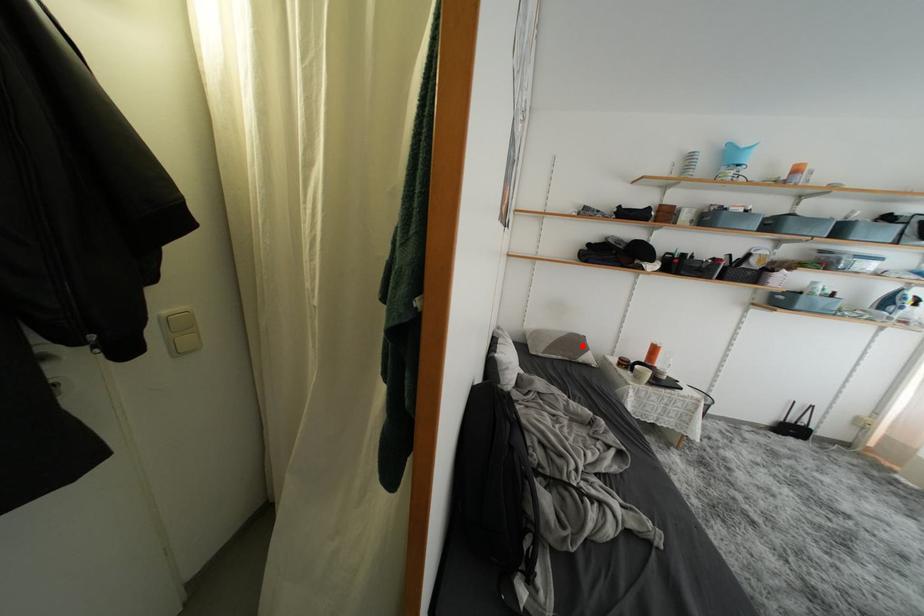
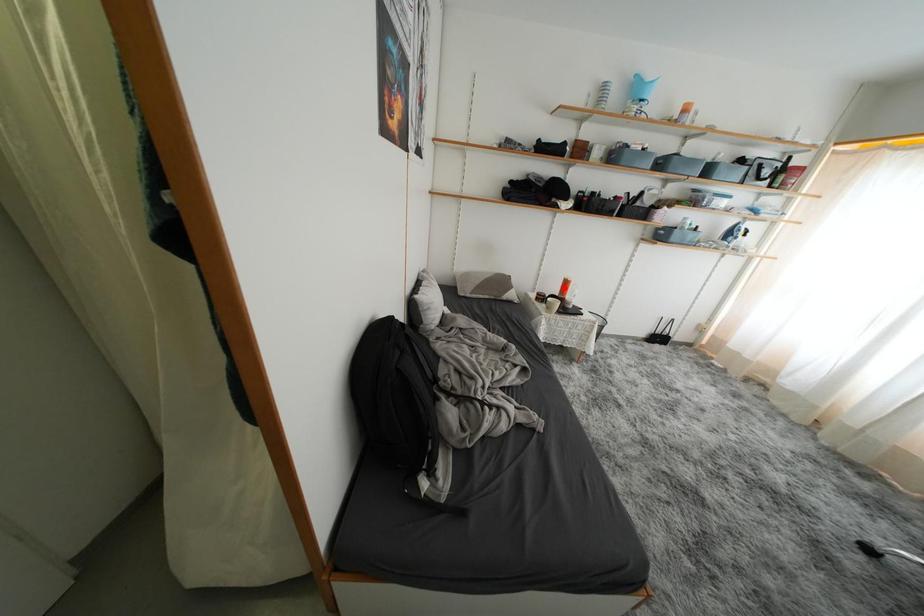
I am providing you with two images of the same scene from different viewpoints. A red point is marked on the first image and another point is marked on the second image. Are the points marked in image1 and image2 representing the same 3D position?

No